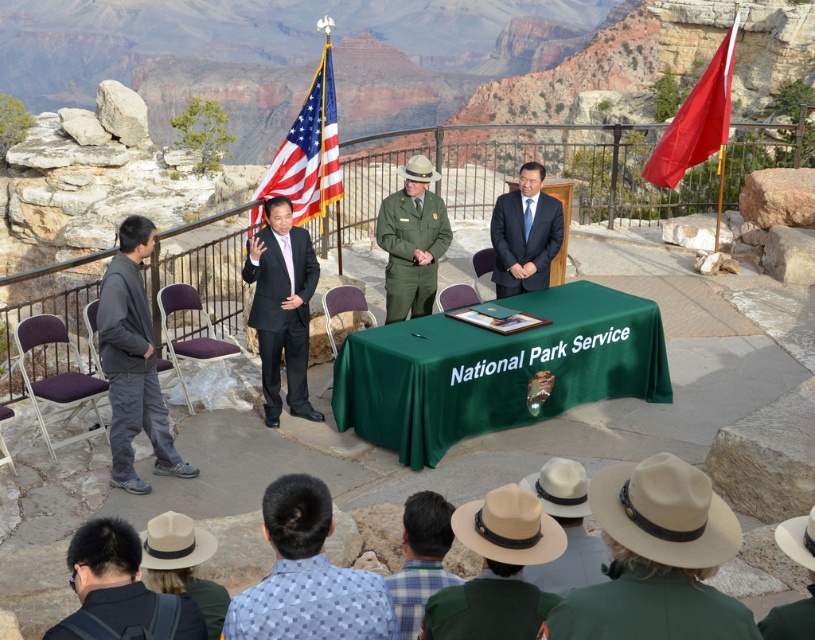
You are a photographer at the overlook and want to capture both the green uniform at center and the matte black suit at center in a single frame. Which of the two is closer to the camera based on their positions?

The green uniform at center is positioned under the matte black suit at center, meaning it is closer to the camera.

You are a photographer at the overlook. You need to capture a photo of the black matte suit at center without the american flag at upper center appearing in the background. Is this possible based on their positions?

The black matte suit at center is in front of the american flag at upper center, so the flag would be behind the suit in the photo. To avoid the flag in the background, you would need to position the camera so that the black matte suit at center blocks the view of the american flag at upper center. This might be achievable by adjusting the angle or moving closer to the suit.